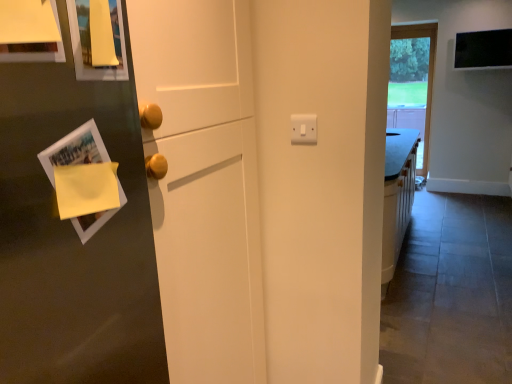
Question: In the image, is yellow paper at left on the left side or the right side of transparent glass window at upper right?

Choices:
 (A) left
 (B) right

Answer: (A)

Question: Is yellow paper at left wider or thinner than transparent glass window at upper right?

Choices:
 (A) thin
 (B) wide

Answer: (B)

Question: From a real-world perspective, relative to transparent glass window at upper right, is yellow paper at left vertically above or below?

Choices:
 (A) below
 (B) above

Answer: (B)

Question: From a real-world perspective, relative to yellow paper at left, is transparent glass window at upper right vertically above or below?

Choices:
 (A) below
 (B) above

Answer: (A)

Question: Visually, is transparent glass window at upper right positioned to the left or to the right of yellow paper at left?

Choices:
 (A) right
 (B) left

Answer: (A)

Question: Considering their positions, is transparent glass window at upper right located in front of or behind yellow paper at left?

Choices:
 (A) behind
 (B) front

Answer: (A)

Question: Looking at their shapes, would you say transparent glass window at upper right is wider or thinner than yellow paper at left?

Choices:
 (A) wide
 (B) thin

Answer: (B)